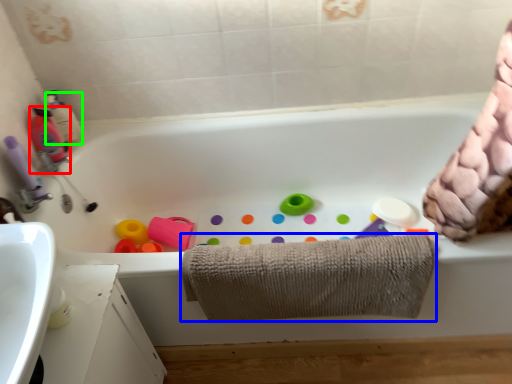
Question: Estimate the real-world distances between objects in this image. Which object is farther from cleaning product (highlighted by a red box), towel (highlighted by a blue box) or cleaning product (highlighted by a green box)?

Choices:
 (A) towel
 (B) cleaning product

Answer: (A)